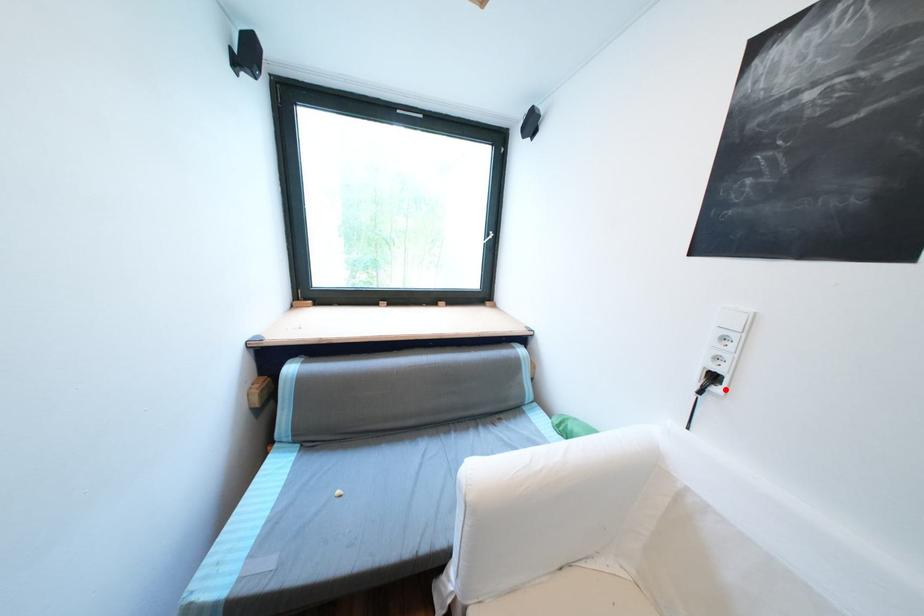
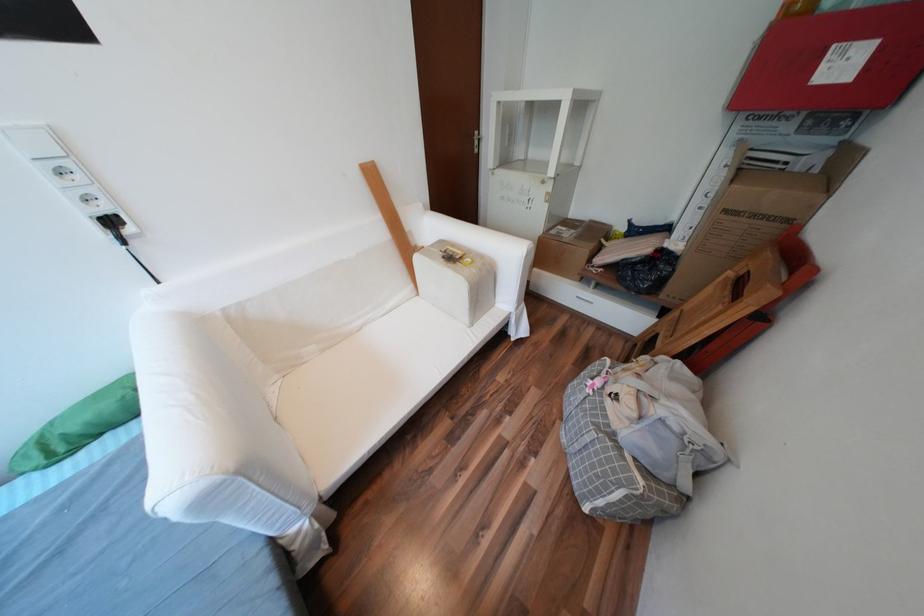
Locate, in the second image, the point that corresponds to the highlighted location in the first image.

(138, 231)